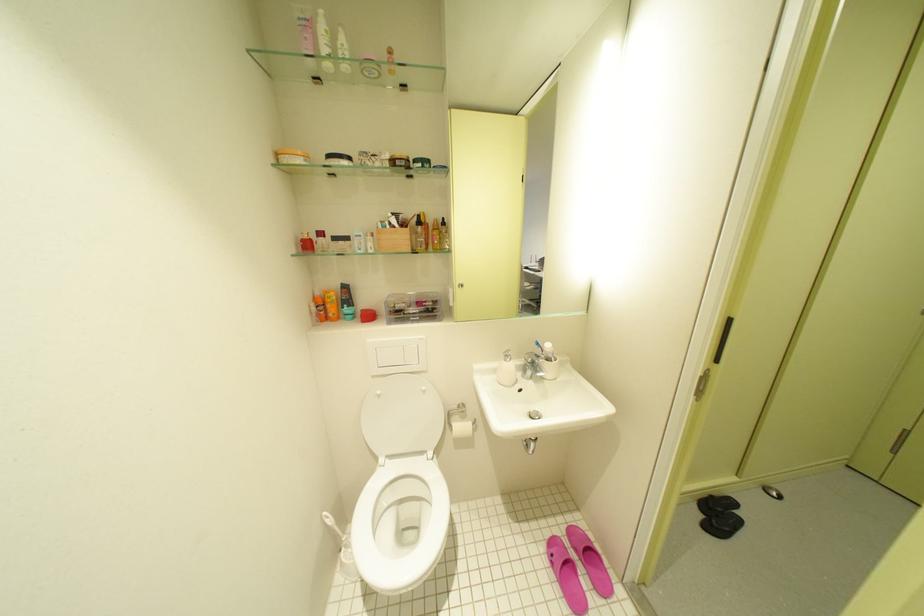
Describe the element at coordinates (531, 366) in the screenshot. The width and height of the screenshot is (924, 616). I see `the sink faucet handle` at that location.